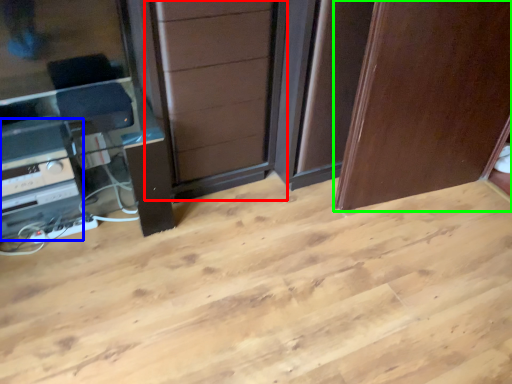
Question: Estimate the real-world distances between objects in this image. Which object is farther from screen door (highlighted by a red box), appliance (highlighted by a blue box) or door (highlighted by a green box)?

Choices:
 (A) appliance
 (B) door

Answer: (A)